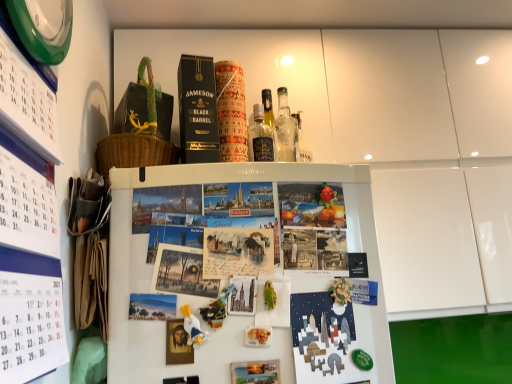
This screenshot has width=512, height=384. Describe the element at coordinates (182, 272) in the screenshot. I see `vintage paper postcard at center, which ranks as the first book cover in top-to-bottom order` at that location.

Locate an element on the screen. The height and width of the screenshot is (384, 512). matte paper book cover at center, arranged as the first book cover when ordered from the bottom is located at coordinates (255, 372).

What do you see at coordinates (236, 317) in the screenshot? I see `white matte refrigerator at center` at bounding box center [236, 317].

Locate an element on the screen. The height and width of the screenshot is (384, 512). white paper calendar at left is located at coordinates (27, 206).

You are a GUI agent. You are given a task and a screenshot of the screen. Output one action in this format:
    pyautogui.click(x=<x>, y=<y>)
    Task: Click on the matte paper postcard at upper center
    The height and width of the screenshot is (384, 512).
    Given the screenshot: What is the action you would take?
    pyautogui.click(x=313, y=226)

Could you tell me if vintage paper postcard at center, which is the second book cover in right-to-left order, is turned towards green plastic clock at upper left?

No, vintage paper postcard at center, which is the second book cover in right-to-left order, is not aimed at green plastic clock at upper left.

Looking at the image, does vintage paper postcard at center, which ranks as the first book cover in top-to-bottom order, seem bigger or smaller compared to green plastic clock at upper left?

Considering their sizes, vintage paper postcard at center, which ranks as the first book cover in top-to-bottom order, takes up less space than green plastic clock at upper left.

Is vintage paper postcard at center, which ranks as the 1th book cover in left-to-right order, touching green plastic clock at upper left?

No, vintage paper postcard at center, which ranks as the 1th book cover in left-to-right order, is not next to green plastic clock at upper left.

Considering the sizes of objects vintage paper postcard at center, which ranks as the 1th book cover in left-to-right order, and green plastic clock at upper left in the image provided, who is wider, vintage paper postcard at center, which ranks as the 1th book cover in left-to-right order, or green plastic clock at upper left?

vintage paper postcard at center, which ranks as the 1th book cover in left-to-right order, is wider.

Would you say white paper calendar at left is outside matte paper book cover at center, acting as the first book cover starting from the right?

white paper calendar at left is positioned outside matte paper book cover at center, acting as the first book cover starting from the right.

Is white paper calendar at left oriented towards matte paper book cover at center, which is counted as the 2th book cover, starting from the left?

No.

From the image's perspective, between white paper calendar at left and matte paper book cover at center, which ranks as the second book cover in top-to-bottom order, who is located below?

matte paper book cover at center, which ranks as the second book cover in top-to-bottom order, from the image's perspective.

From the image's perspective, starting from the green plastic clock at upper left, which book cover is the 1st one below? Please provide its 2D coordinates.

[(182, 272)]

Is vintage paper postcard at center, marked as the 2th book cover in a bottom-to-top arrangement, a part of green plastic clock at upper left?

No, vintage paper postcard at center, marked as the 2th book cover in a bottom-to-top arrangement, is located outside of green plastic clock at upper left.

Looking at this image, which object is further away from the camera, green plastic clock at upper left or vintage paper postcard at center, marked as the 2th book cover in a bottom-to-top arrangement?

vintage paper postcard at center, marked as the 2th book cover in a bottom-to-top arrangement, is more distant.

Is vintage paper postcard at center, marked as the 2th book cover in a bottom-to-top arrangement, at the back of green plastic clock at upper left?

green plastic clock at upper left does not have its back to vintage paper postcard at center, marked as the 2th book cover in a bottom-to-top arrangement.

Is vintage paper postcard at center, which ranks as the 1th book cover in left-to-right order, behind matte paper book cover at center, arranged as the first book cover when ordered from the bottom?

Yes, vintage paper postcard at center, which ranks as the 1th book cover in left-to-right order, is further from the camera.

Is point (162, 253) closer to viewer compared to point (247, 380)?

No, it is not.

What are the coordinates of `book cover below the vintage paper postcard at center, which ranks as the first book cover in top-to-bottom order (from the image's perspective)` in the screenshot? It's located at (255, 372).

Is vintage paper postcard at center, which is the second book cover in right-to-left order, turned away from matte paper book cover at center, which ranks as the second book cover in top-to-bottom order?

That's not correct — vintage paper postcard at center, which is the second book cover in right-to-left order, is not looking away from matte paper book cover at center, which ranks as the second book cover in top-to-bottom order.

The image size is (512, 384). I want to click on clock on the left of white paper calendar at left, so click(42, 27).

Is green plastic clock at upper left inside the boundaries of white paper calendar at left, or outside?

green plastic clock at upper left is located inside white paper calendar at left.

Is the position of green plastic clock at upper left less distant than that of white paper calendar at left?

No.

Can you confirm if green plastic clock at upper left is wider than white paper calendar at left?

No, green plastic clock at upper left is not wider than white paper calendar at left.

Based on the photo, from the image's perspective, which object appears higher, matte paper postcard at upper center or translucent glass bottle at center?

From the image's view, translucent glass bottle at center is above.

Considering the sizes of matte paper postcard at upper center and translucent glass bottle at center in the image, is matte paper postcard at upper center taller or shorter than translucent glass bottle at center?

Clearly, matte paper postcard at upper center is shorter compared to translucent glass bottle at center.

How many degrees apart are the facing directions of matte paper postcard at upper center and translucent glass bottle at center?

matte paper postcard at upper center and translucent glass bottle at center are facing 9.25 degrees away from each other.

Considering the positions of objects matte paper postcard at upper center and translucent glass bottle at center in the image provided, who is more to the right, matte paper postcard at upper center or translucent glass bottle at center?

matte paper postcard at upper center is more to the right.

Are green plastic clock at upper left and translucent glass bottle at center located far from each other?

No, there isn't a large distance between green plastic clock at upper left and translucent glass bottle at center.

Between point (58, 21) and point (273, 149), which one is positioned in front?

The point (58, 21) is more forward.

How many degrees apart are the facing directions of green plastic clock at upper left and translucent glass bottle at center?

The facing directions of green plastic clock at upper left and translucent glass bottle at center are 89 degrees apart.

Does green plastic clock at upper left have a greater height compared to translucent glass bottle at center?

Indeed, green plastic clock at upper left has a greater height compared to translucent glass bottle at center.

From the image's perspective, count 1st book covers downward from the green plastic clock at upper left and point to it. Please provide its 2D coordinates.

[(182, 272)]

This screenshot has width=512, height=384. Identify the location of bulletin board that appears above the matte paper book cover at center, acting as the first book cover starting from the right (from a real-world perspective). click(x=27, y=206).

Looking at the image, which one is located further to green plastic clock at upper left, matte paper book cover at center, acting as the first book cover starting from the right, or white paper calendar at left?

matte paper book cover at center, acting as the first book cover starting from the right, lies further to green plastic clock at upper left than the other object.

Looking at the image, which one is located closer to matte paper postcard at upper center, green plastic clock at upper left or translucent glass bottle at center?

translucent glass bottle at center lies closer to matte paper postcard at upper center than the other object.

From the image, which object appears to be farther from matte paper book cover at center, which is counted as the 2th book cover, starting from the left, white paper calendar at left or vintage paper postcard at center, marked as the 2th book cover in a bottom-to-top arrangement?

Among the two, white paper calendar at left is located further to matte paper book cover at center, which is counted as the 2th book cover, starting from the left.

Considering their positions, is vintage paper postcard at center, marked as the 2th book cover in a bottom-to-top arrangement, positioned further to matte paper postcard at upper center than white matte refrigerator at center?

vintage paper postcard at center, marked as the 2th book cover in a bottom-to-top arrangement, lies further to matte paper postcard at upper center than the other object.

When comparing their distances from white matte refrigerator at center, does matte paper book cover at center, which is counted as the 2th book cover, starting from the left, or green plastic clock at upper left seem closer?

matte paper book cover at center, which is counted as the 2th book cover, starting from the left.

Based on their spatial positions, is white matte refrigerator at center or vintage paper postcard at center, which ranks as the first book cover in top-to-bottom order, further from matte paper book cover at center, which is counted as the 2th book cover, starting from the left?

white matte refrigerator at center.

In the scene shown: Looking at the image, which one is located further to translucent glass bottle at center, white matte refrigerator at center or green plastic clock at upper left?

green plastic clock at upper left lies further to translucent glass bottle at center than the other object.

When comparing their distances from white matte refrigerator at center, does matte paper postcard at upper center or translucent glass bottle at center seem closer?

Among the two, matte paper postcard at upper center is located nearer to white matte refrigerator at center.

This screenshot has width=512, height=384. Find the location of `bulletin board between green plastic clock at upper left and vintage paper postcard at center, which is the second book cover in right-to-left order, from top to bottom`. bulletin board between green plastic clock at upper left and vintage paper postcard at center, which is the second book cover in right-to-left order, from top to bottom is located at coordinates (27, 206).

Identify the location of magazine between white matte refrigerator at center and translucent glass bottle at center along the z-axis. (313, 226).

Locate an element on the screen. refrigerator positioned between green plastic clock at upper left and translucent glass bottle at center from near to far is located at coordinates (236, 317).

Identify the location of refrigerator that lies between translucent glass bottle at center and matte paper book cover at center, which is counted as the 2th book cover, starting from the left, from top to bottom. (236, 317).